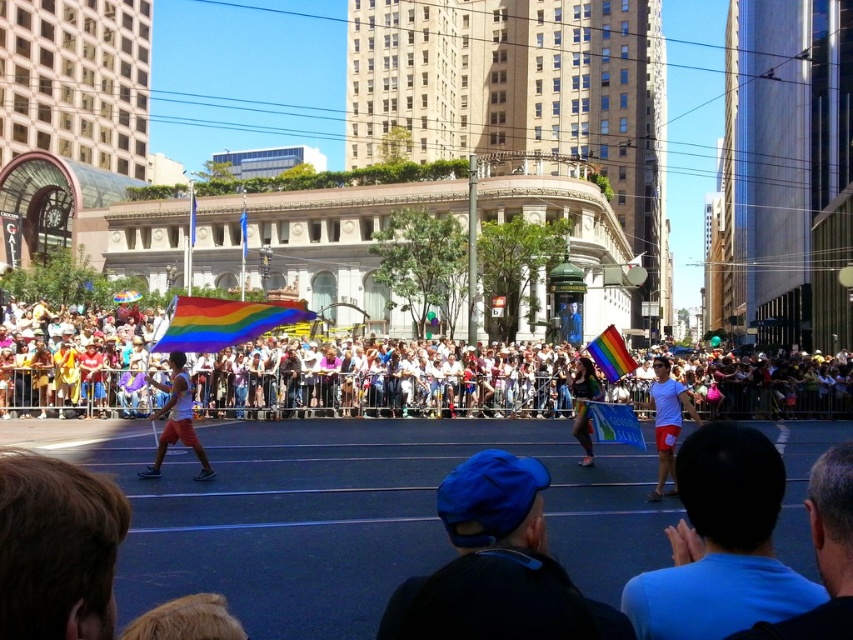
You are standing at the point with coordinates (396, 378) in this image. What is the nearest object to you?

The point at (396, 378) corresponds to the white cotton crowd at center, so the nearest object to you is the white cotton crowd at center.

Based on the photo, you are a photographer standing behind the barricades and want to capture a photo of the white cotton shirt at center without the white cotton crowd at center blocking the view. Is this possible based on their positions?

The white cotton crowd at center is located above the white cotton shirt at center, so the crowd would block the view of the shirt unless you adjust your angle to look below the crowd.